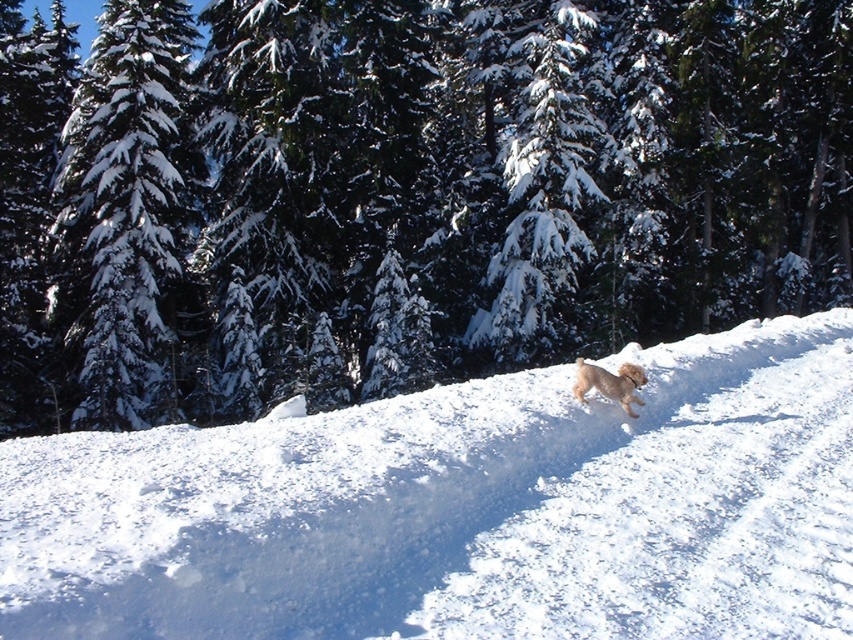
Looking at this image, you are standing in the snowy landscape and notice the white fluffy snow at center and the fuzzy golden dog at center. Which object is positioned lower in the image?

The white fluffy snow at center is located below the fuzzy golden dog at center, so the white fluffy snow at center is positioned lower in the image.

You are standing at the base of the green matte tree at upper center and want to throw a ball to the fuzzy golden dog at center. Given that the ball travels at 15 feet per second, how many seconds will it take for the ball to reach the dog?

The distance between the green matte tree at upper center and the fuzzy golden dog at center is 64.30 feet. At a speed of 15 feet per second, the ball will take approximately 4.29 seconds to reach the dog.